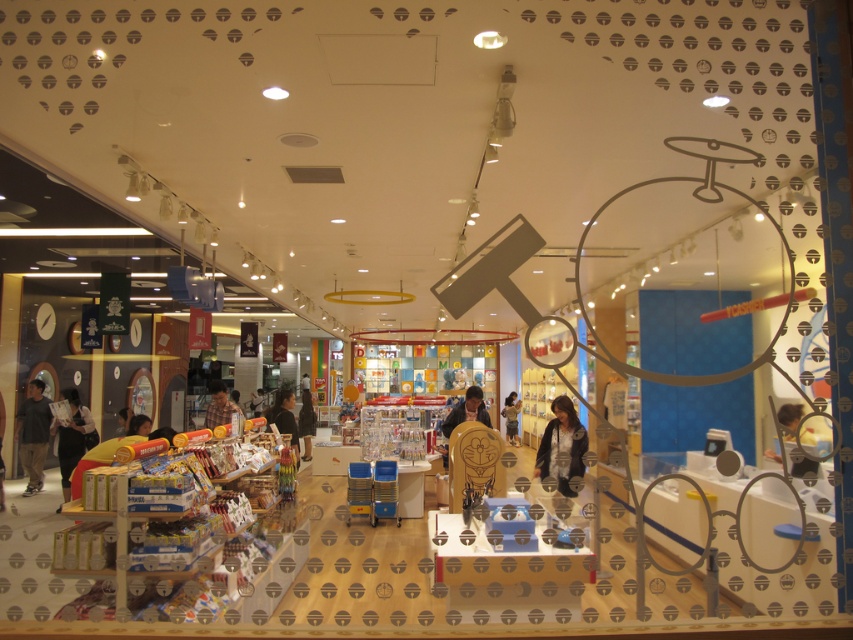
Can you confirm if dark gray fabric shirt at lower left is taller than dark brown hair at center?

Correct, dark gray fabric shirt at lower left is much taller as dark brown hair at center.

Which is in front, point (83, 449) or point (784, 419)?

Positioned in front is point (784, 419).

Does point (79, 432) lie behind point (784, 428)?

Yes, point (79, 432) is farther from viewer.

The image size is (853, 640). I want to click on dark gray fabric shirt at lower left, so click(71, 436).

Does black matte jacket at center appear on the right side of light brown shirt at center?

Yes, black matte jacket at center is to the right of light brown shirt at center.

Who is more distant from viewer, (x=556, y=428) or (x=224, y=390)?

Point (x=224, y=390)

Locate an element on the screen. Image resolution: width=853 pixels, height=640 pixels. black matte jacket at center is located at coordinates (561, 445).

Locate an element on the screen. The image size is (853, 640). black matte jacket at center is located at coordinates (561, 445).

Is black matte jacket at center smaller than dark gray cotton pants at lower left?

Yes, black matte jacket at center is smaller than dark gray cotton pants at lower left.

Does point (561, 476) come behind point (25, 426)?

No, it is not.

The image size is (853, 640). What do you see at coordinates (561, 445) in the screenshot? I see `black matte jacket at center` at bounding box center [561, 445].

Locate an element on the screen. Image resolution: width=853 pixels, height=640 pixels. black matte jacket at center is located at coordinates [561, 445].